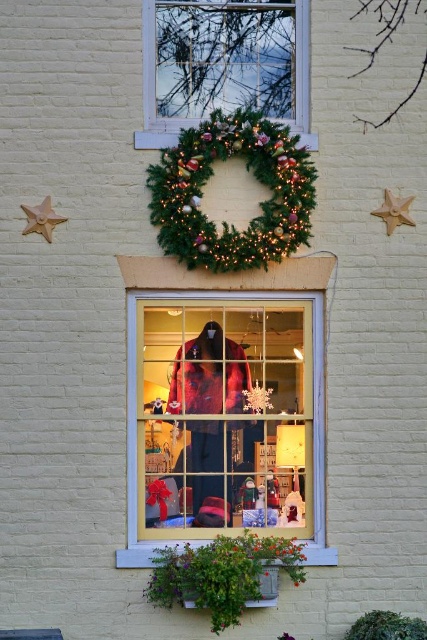
Question: Where is green textured wreath at upper center located in relation to gold matte star at upper left in the image?

Choices:
 (A) below
 (B) above

Answer: (B)

Question: Can you confirm if gold metallic star at upper right is smaller than green plastic window box at lower center?

Choices:
 (A) no
 (B) yes

Answer: (B)

Question: Which object appears farthest from the camera in this image?

Choices:
 (A) green textured wreath at upper center
 (B) gold metallic star at upper right
 (C) gold matte star at upper left
 (D) green plastic window box at lower center

Answer: (B)

Question: Estimate the real-world distances between objects in this image. Which object is farther from the green textured wreath at upper center?

Choices:
 (A) gold metallic star at upper right
 (B) gold matte star at upper left

Answer: (B)

Question: Which object appears farthest from the camera in this image?

Choices:
 (A) gold matte star at upper left
 (B) green garland at upper center
 (C) gold metallic star at upper right
 (D) velvet red coat at center

Answer: (C)

Question: Is green garland at upper center further to camera compared to gold matte star at upper left?

Choices:
 (A) no
 (B) yes

Answer: (B)